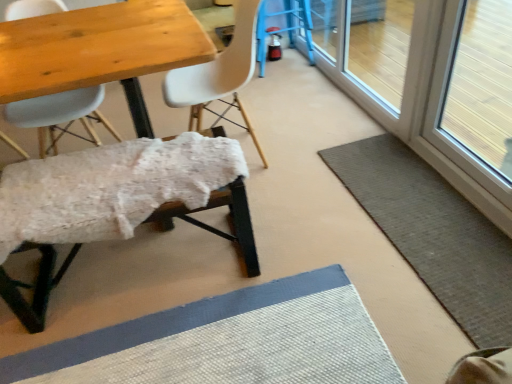
Question: Considering the relative sizes of white fluffy bench at lower left, the second chair when ordered from left to right, and white matte chair at center, positioned as the 3th chair in left-to-right order, in the image provided, is white fluffy bench at lower left, the second chair when ordered from left to right, bigger than white matte chair at center, positioned as the 3th chair in left-to-right order,?

Choices:
 (A) no
 (B) yes

Answer: (A)

Question: Does white fluffy bench at lower left, the second chair when ordered from left to right, appear on the right side of white matte chair at center, which is the first chair from right to left?

Choices:
 (A) no
 (B) yes

Answer: (A)

Question: Is white fluffy bench at lower left, placed as the 2th chair when sorted from right to left, wider than white matte chair at center, which is the first chair from right to left?

Choices:
 (A) no
 (B) yes

Answer: (A)

Question: Does white fluffy bench at lower left, the second chair when ordered from left to right, have a lesser height compared to white matte chair at center, positioned as the 3th chair in left-to-right order?

Choices:
 (A) no
 (B) yes

Answer: (B)

Question: Considering the relative positions of white fluffy bench at lower left, the second chair when ordered from left to right, and white matte chair at center, which is the first chair from right to left, in the image provided, is white fluffy bench at lower left, the second chair when ordered from left to right, in front of white matte chair at center, which is the first chair from right to left,?

Choices:
 (A) yes
 (B) no

Answer: (A)

Question: From a real-world perspective, is white fluffy bench at lower left, placed as the 2th chair when sorted from right to left, over white matte chair at center, positioned as the 3th chair in left-to-right order?

Choices:
 (A) no
 (B) yes

Answer: (A)

Question: Is gray woven bath mat at lower right at the right side of matte white chair at upper left, marked as the 1th chair in a left-to-right arrangement?

Choices:
 (A) yes
 (B) no

Answer: (A)

Question: Is gray woven bath mat at lower right shorter than matte white chair at upper left, marked as the 1th chair in a left-to-right arrangement?

Choices:
 (A) yes
 (B) no

Answer: (A)

Question: Does gray woven bath mat at lower right have a larger size compared to matte white chair at upper left, marked as the 1th chair in a left-to-right arrangement?

Choices:
 (A) no
 (B) yes

Answer: (A)

Question: Does gray woven bath mat at lower right turn towards matte white chair at upper left, the third chair when ordered from right to left?

Choices:
 (A) no
 (B) yes

Answer: (A)

Question: From a real-world perspective, is gray woven bath mat at lower right over matte white chair at upper left, marked as the 1th chair in a left-to-right arrangement?

Choices:
 (A) yes
 (B) no

Answer: (B)

Question: Is gray woven bath mat at lower right outside matte white chair at upper left, marked as the 1th chair in a left-to-right arrangement?

Choices:
 (A) no
 (B) yes

Answer: (B)

Question: Is gray woven bath mat at lower right positioned with its back to white fluffy bench at lower left, the second chair when ordered from left to right?

Choices:
 (A) yes
 (B) no

Answer: (B)